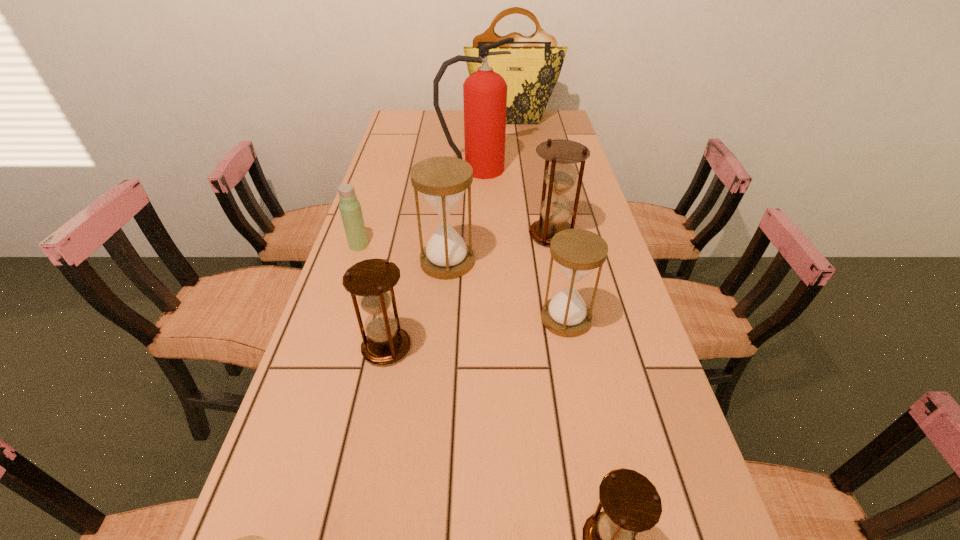
I want to click on object that is the third closest to the second white hourglass from right to left, so click(x=372, y=280).

The image size is (960, 540). I want to click on hourglass that can be found as the fifth closest to the biggest brown hourglass, so coord(252,539).

Locate an element on the screen. the sixth closest hourglass to the eighth nearest object is located at coordinates (252, 539).

Select which brown hourglass is the second closest to the eighth farthest object. Please provide its 2D coordinates. Your answer should be formatted as a tuple, i.e. [(x, y)], where the tuple contains the x and y coordinates of a point satisfying the conditions above.

[(560, 176)]

Choose which brown hourglass is the nearest neighbor to the second farthest object. Please provide its 2D coordinates. Your answer should be formatted as a tuple, i.e. [(x, y)], where the tuple contains the x and y coordinates of a point satisfying the conditions above.

[(560, 176)]

Select which white hourglass is the closest to the farthest object. Please provide its 2D coordinates. Your answer should be formatted as a tuple, i.e. [(x, y)], where the tuple contains the x and y coordinates of a point satisfying the conditions above.

[(442, 181)]

This screenshot has height=540, width=960. Identify the location of white hourglass that is the closest to the second smallest white hourglass. (442, 181).

Image resolution: width=960 pixels, height=540 pixels. In order to click on free space that satisfies the following two spatial constraints: 1. on the back side of the farthest brown hourglass; 2. on the left side of the leftmost brown hourglass in this screenshot , I will do `click(409, 235)`.